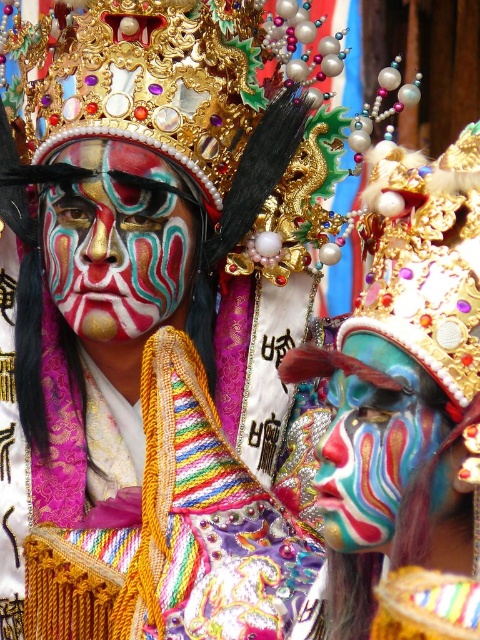
Based on the scene description, what color face paint is located at the coordinates point (406, 406)?

The point (406, 406) has matte teal face paint at center.

You are an observer standing in front of the scene. You notice the matte gold crown at upper center and the multicolored painted face at center. Which object is closer to you?

The matte gold crown at upper center is closer to you because the multicolored painted face at center is behind it.

You are a photographer standing 10 meters away from the two performers with matte teal face paint at center and matte painted face at center. You want to take a photo that captures both of them in the frame. Given that your camera has a maximum zoom range of 12 meters, will you be able to capture both performers in the same frame?

The distance between the matte teal face paint at center and matte painted face at center is 16.08 meters, which exceeds the camera maximum zoom range of 12 meters. Therefore, you cannot capture both performers in the same frame.